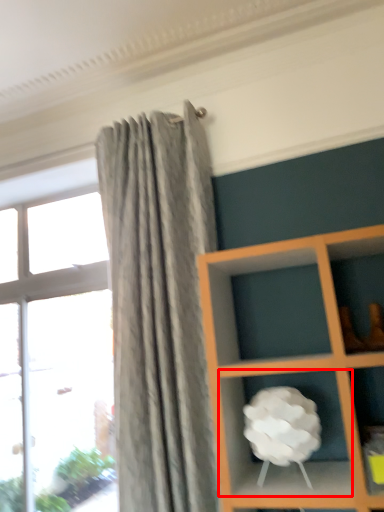
Question: Considering the relative positions of cabinet (annotated by the red box) and window in the image provided, where is cabinet (annotated by the red box) located with respect to the staircase?

Choices:
 (A) left
 (B) right

Answer: (B)